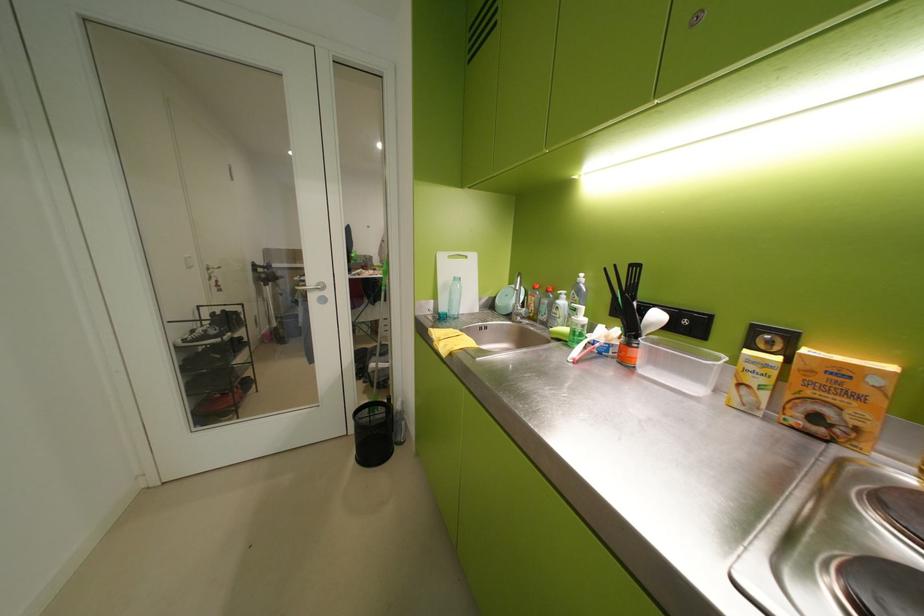
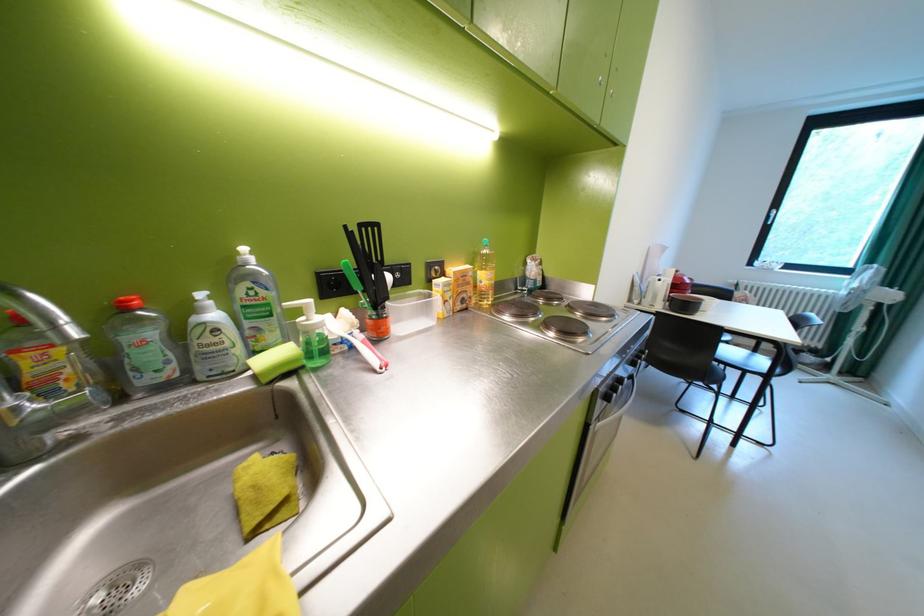
First-person continuous shooting, in which direction is the camera rotating?

The rotation direction of the camera is right-down.